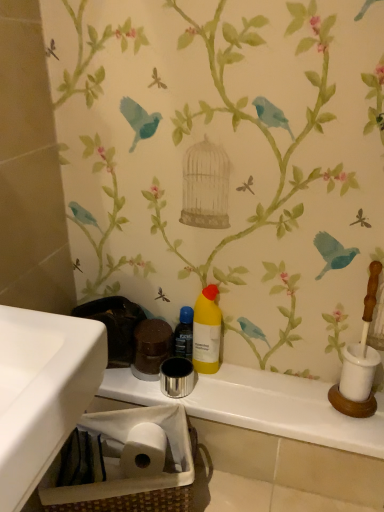
Question: Does woven brown basket at lower left have a greater width compared to translucent plastic bottle at center?

Choices:
 (A) no
 (B) yes

Answer: (B)

Question: Would you say woven brown basket at lower left contains translucent plastic bottle at center?

Choices:
 (A) yes
 (B) no

Answer: (B)

Question: Is woven brown basket at lower left taller than translucent plastic bottle at center?

Choices:
 (A) no
 (B) yes

Answer: (B)

Question: Considering the relative sizes of woven brown basket at lower left and translucent plastic bottle at center in the image provided, is woven brown basket at lower left thinner than translucent plastic bottle at center?

Choices:
 (A) yes
 (B) no

Answer: (B)

Question: From a real-world perspective, is woven brown basket at lower left on translucent plastic bottle at center?

Choices:
 (A) no
 (B) yes

Answer: (A)

Question: From their relative heights in the image, would you say woven brown basket at lower left is taller or shorter than translucent plastic bottle at center?

Choices:
 (A) short
 (B) tall

Answer: (B)

Question: Looking at their shapes, would you say woven brown basket at lower left is wider or thinner than translucent plastic bottle at center?

Choices:
 (A) wide
 (B) thin

Answer: (A)

Question: Is point (84, 421) closer or farther from the camera than point (183, 327)?

Choices:
 (A) farther
 (B) closer

Answer: (B)

Question: From the image's perspective, is woven brown basket at lower left above or below translucent plastic bottle at center?

Choices:
 (A) above
 (B) below

Answer: (B)

Question: Considering the positions of yellow matte bottle at center and translucent plastic bottle at center in the image, is yellow matte bottle at center wider or thinner than translucent plastic bottle at center?

Choices:
 (A) thin
 (B) wide

Answer: (B)

Question: In terms of height, does yellow matte bottle at center look taller or shorter compared to translucent plastic bottle at center?

Choices:
 (A) tall
 (B) short

Answer: (A)

Question: Is yellow matte bottle at center bigger or smaller than translucent plastic bottle at center?

Choices:
 (A) small
 (B) big

Answer: (B)

Question: From the image's perspective, relative to translucent plastic bottle at center, is yellow matte bottle at center above or below?

Choices:
 (A) below
 (B) above

Answer: (B)

Question: Is woven brown basket at lower left wider or thinner than yellow matte bottle at center?

Choices:
 (A) wide
 (B) thin

Answer: (A)

Question: From the image's perspective, is woven brown basket at lower left positioned above or below yellow matte bottle at center?

Choices:
 (A) below
 (B) above

Answer: (A)